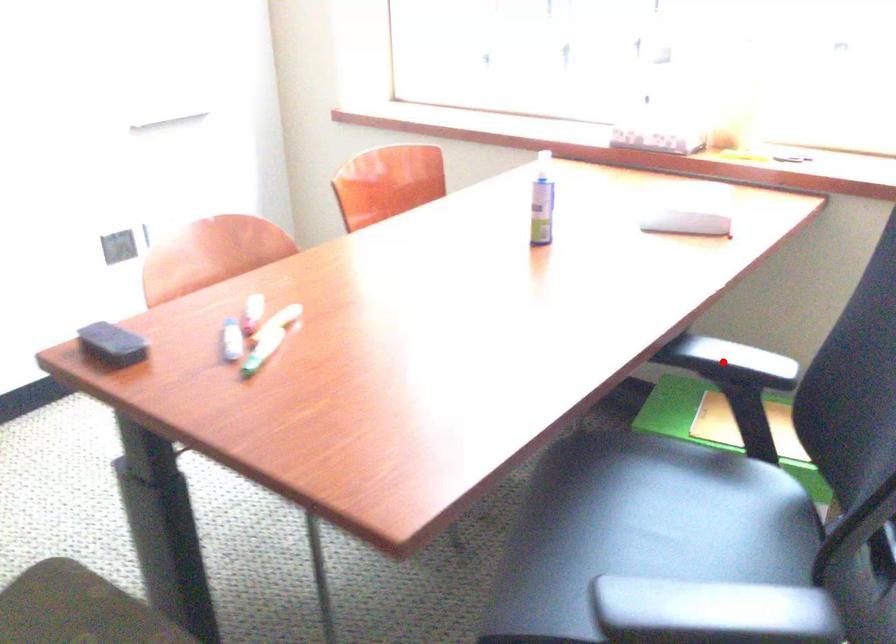
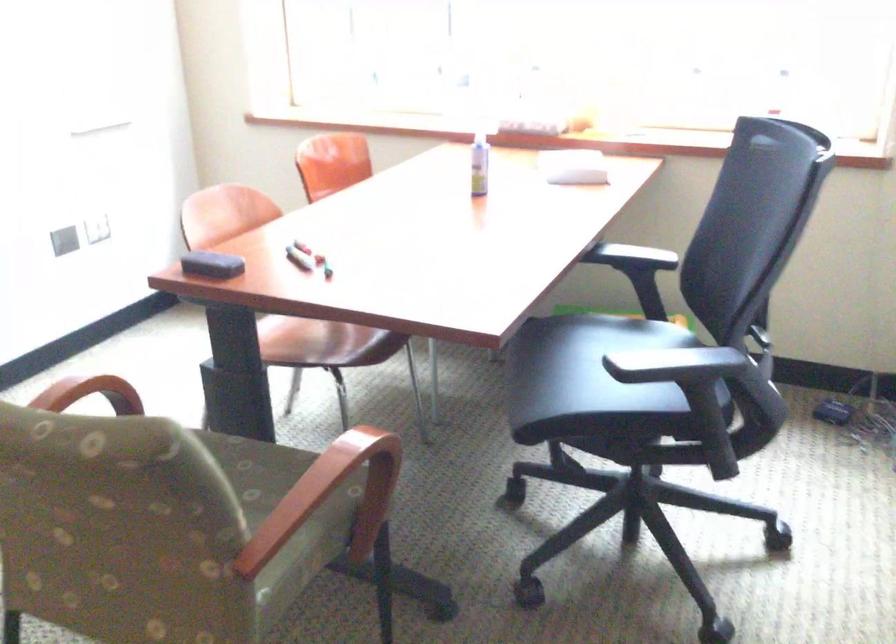
Locate, in the second image, the point that corresponds to the highlighted location in the first image.

(632, 257)